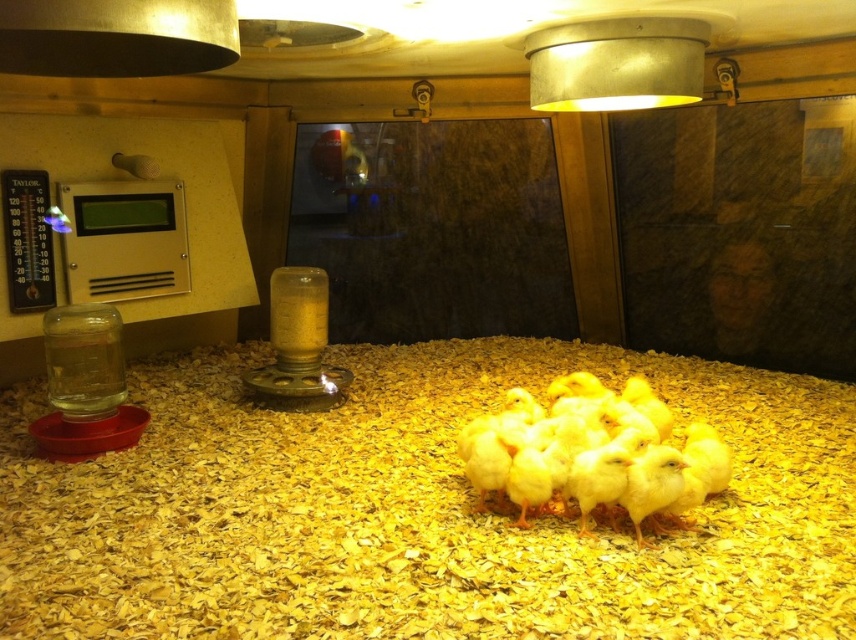
Is point (164, 595) farther from camera compared to point (637, 518)?

No, (164, 595) is closer to viewer.

Is yellow wood chips at center to the left of yellow matte chicken at center from the viewer's perspective?

Yes, yellow wood chips at center is to the left of yellow matte chicken at center.

Is point (360, 570) in front of point (698, 433)?

Yes.

Locate an element on the screen. yellow wood chips at center is located at coordinates (417, 509).